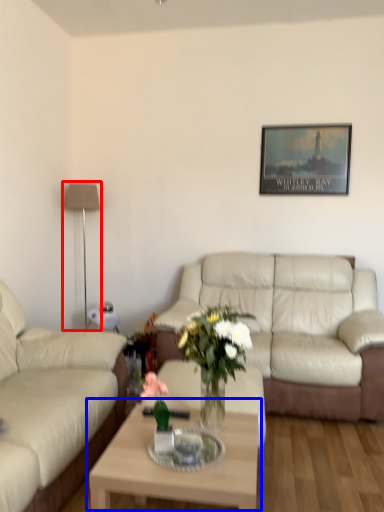
Question: Which object is further to the camera taking this photo, lamp (highlighted by a red box) or coffee table (highlighted by a blue box)?

Choices:
 (A) lamp
 (B) coffee table

Answer: (A)